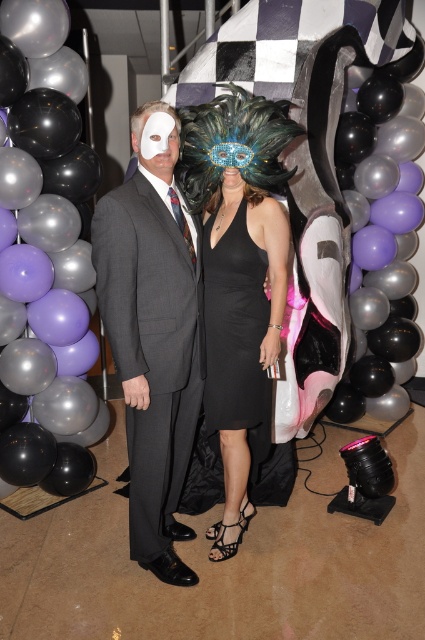
You are a photographer setting up for a formal event. You notice the black glossy balloon at left and the matte gray suit at center in the scene. Based on their positions, which object is more likely to cast a reflection in the camera lens?

The black glossy balloon at left is more likely to cast a reflection in the camera lens because it has a glossy surface, which typically reflects light more than the matte gray suit at center.

Looking at this image, you are a photographer setting up for a formal event. You notice a black glossy balloon at left and a matte gray suit at center in the scene. Which object is positioned higher in the frame?

The black glossy balloon at left is located above the matte gray suit at center, so it is positioned higher in the frame.

You are a photographer trying to focus on the matte gray suit at center. However, there is a black glossy balloon at left in the scene. Which object is closer to you, the photographer, and might cause an obstruction?

The black glossy balloon at left is closer to you than the matte gray suit at center, so it might obstruct your view of the matte gray suit at center.